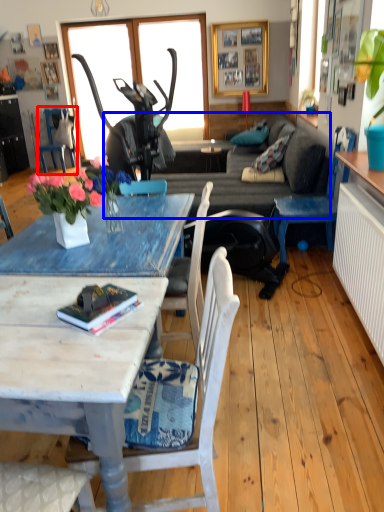
Question: Which point is further to the camera, chair (highlighted by a red box) or studio couch (highlighted by a blue box)?

Choices:
 (A) chair
 (B) studio couch

Answer: (A)